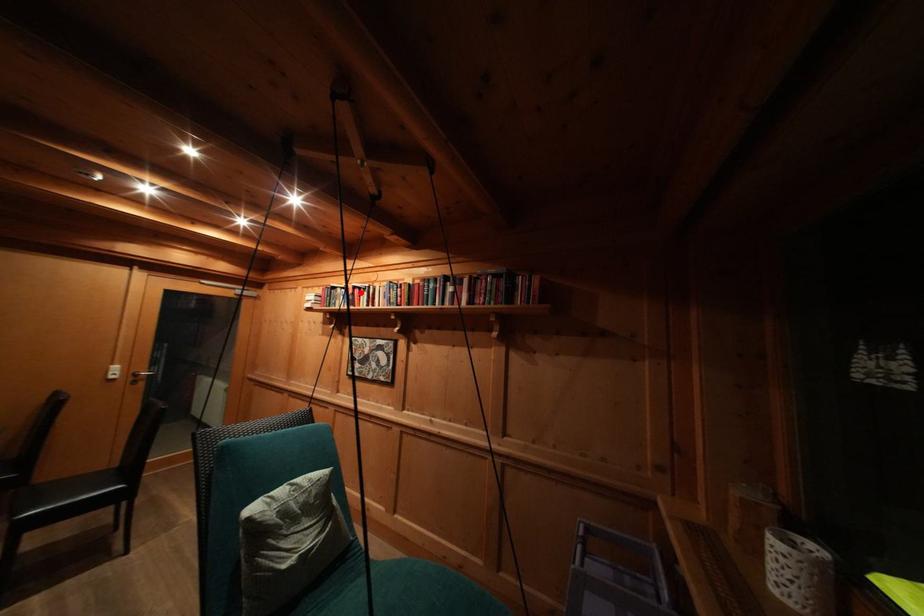
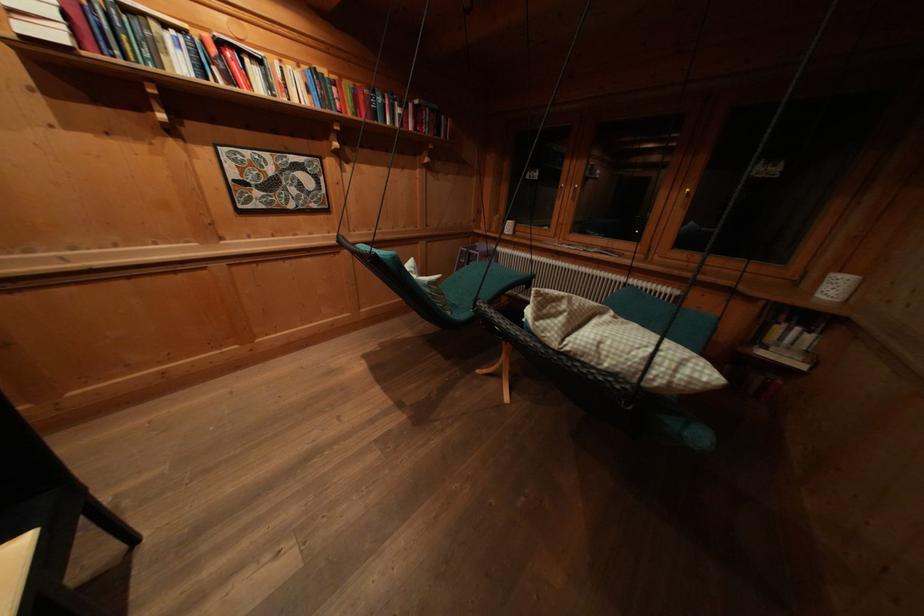
Find the pixel in the second image that matches the highlighted location in the first image.

(225, 47)